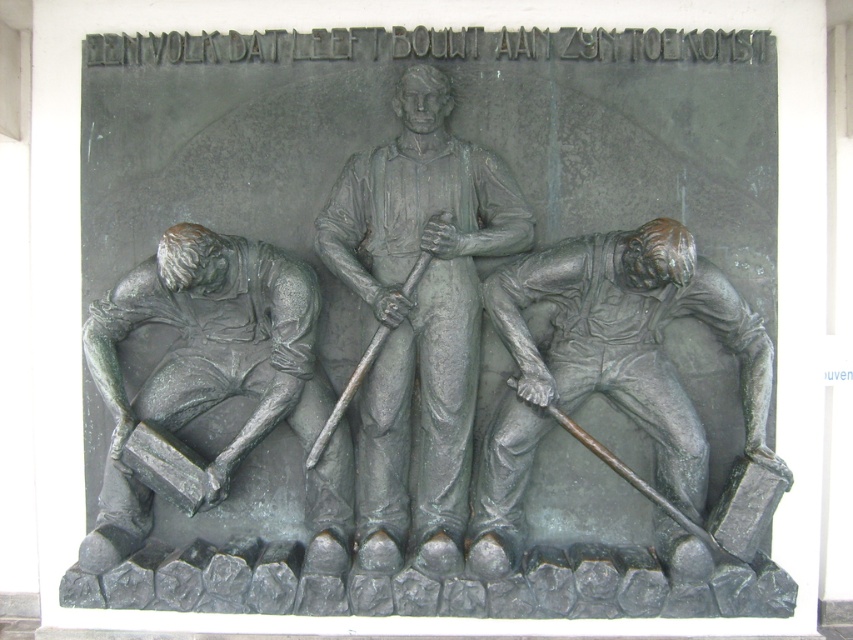
You are an art conservator examining the bronze relief sculpture. You notice a small point marked at coordinates point (x=608, y=365). Based on the description, which part of the sculpture does this point correspond to?

The point (x=608, y=365) is on bronze figure at lower right.